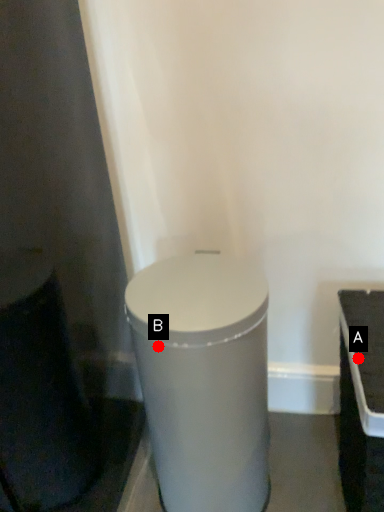
Question: Two points are circled on the image, labeled by A and B beside each circle. Which point is closer to the camera taking this photo?

Choices:
 (A) A is closer
 (B) B is closer

Answer: (B)